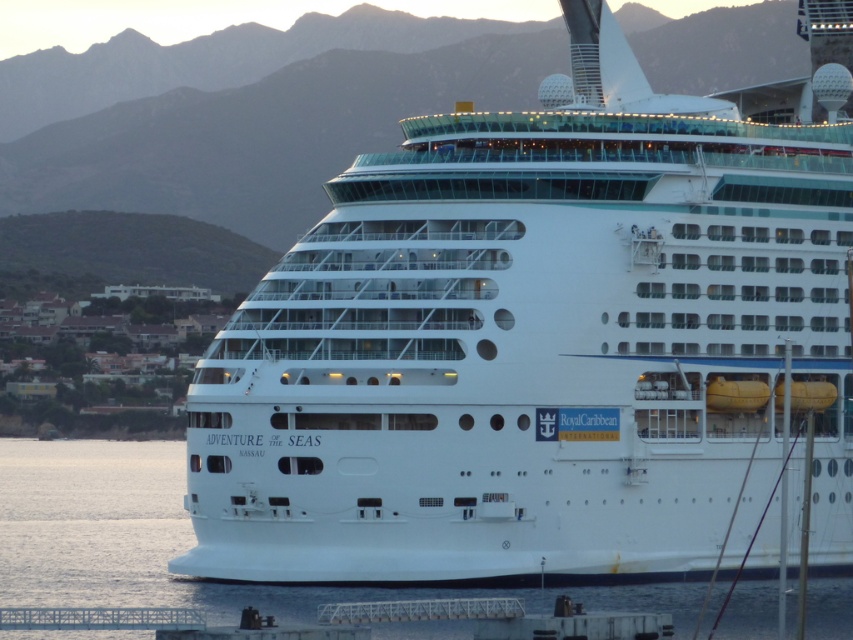
Based on the photo, between white glossy cruise ship at center and clear water at lower center, which one has more height?

With more height is white glossy cruise ship at center.

Between white glossy cruise ship at center and clear water at lower center, which one has less height?

With less height is clear water at lower center.

Locate an element on the screen. The height and width of the screenshot is (640, 853). white glossy cruise ship at center is located at coordinates (537, 342).